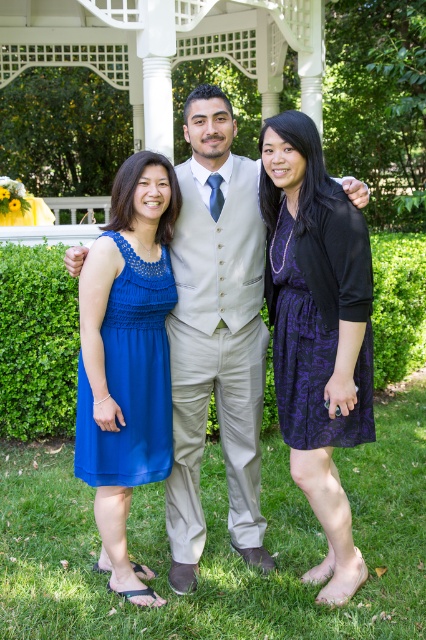
Question: Which object is the closest to the purple brocade dress at center?

Choices:
 (A) purple satin dress at center
 (B) blue chiffon dress at left

Answer: (A)

Question: Can you confirm if purple satin dress at center is wider than blue chiffon dress at left?

Choices:
 (A) no
 (B) yes

Answer: (B)

Question: Which object is farther from the camera taking this photo?

Choices:
 (A) purple satin dress at center
 (B) blue chiffon dress at left
 (C) purple brocade dress at center

Answer: (B)

Question: Among these objects, which one is farthest from the camera?

Choices:
 (A) blue chiffon dress at left
 (B) matte beige vest at center
 (C) purple brocade dress at center
 (D) purple satin dress at center

Answer: (B)

Question: Can you confirm if purple satin dress at center is wider than purple brocade dress at center?

Choices:
 (A) no
 (B) yes

Answer: (B)

Question: Is purple satin dress at center below blue chiffon dress at left?

Choices:
 (A) yes
 (B) no

Answer: (B)